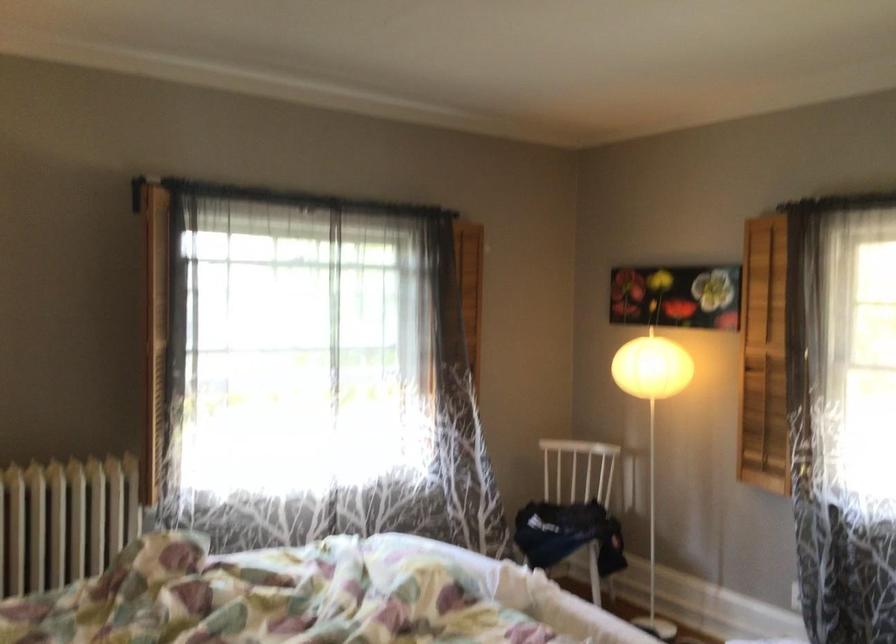
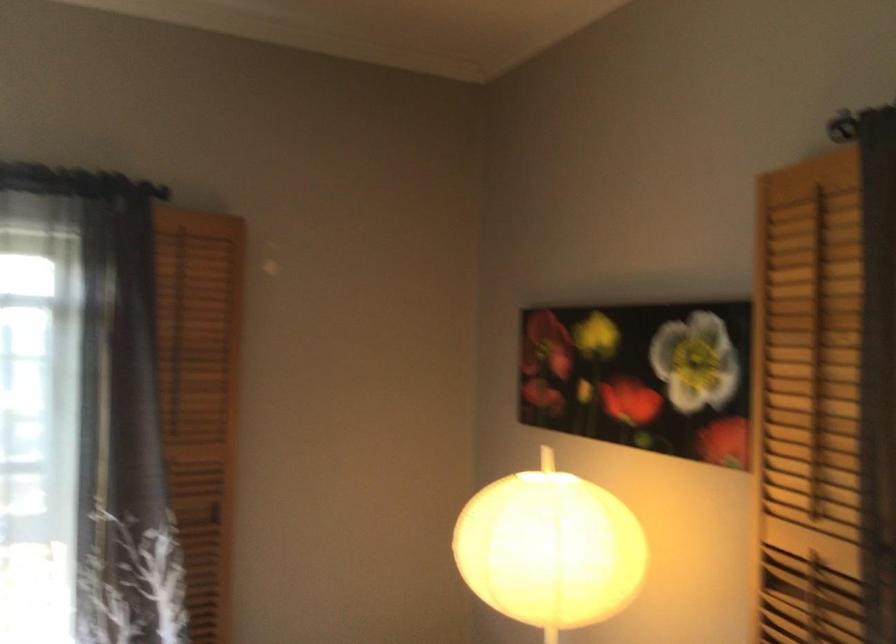
Where in the second image is the point corresponding to (x=804, y=321) from the first image?

(876, 482)